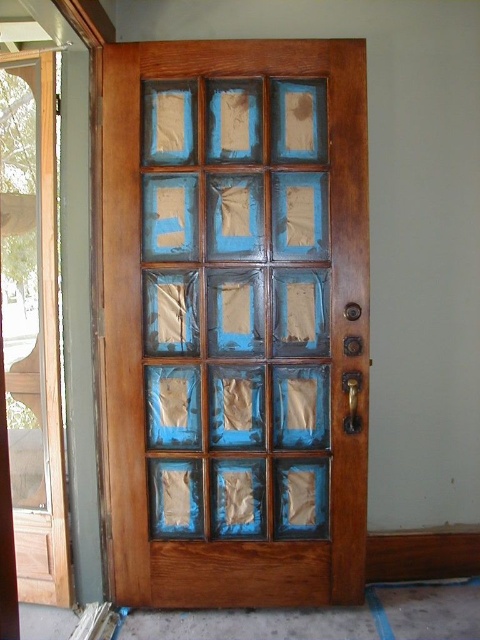
Question: Can you confirm if wooden door at center is bigger than clear glass screen door at left?

Choices:
 (A) yes
 (B) no

Answer: (A)

Question: Is wooden door at center thinner than clear glass screen door at left?

Choices:
 (A) no
 (B) yes

Answer: (A)

Question: Does wooden door at center have a lesser width compared to clear glass screen door at left?

Choices:
 (A) no
 (B) yes

Answer: (A)